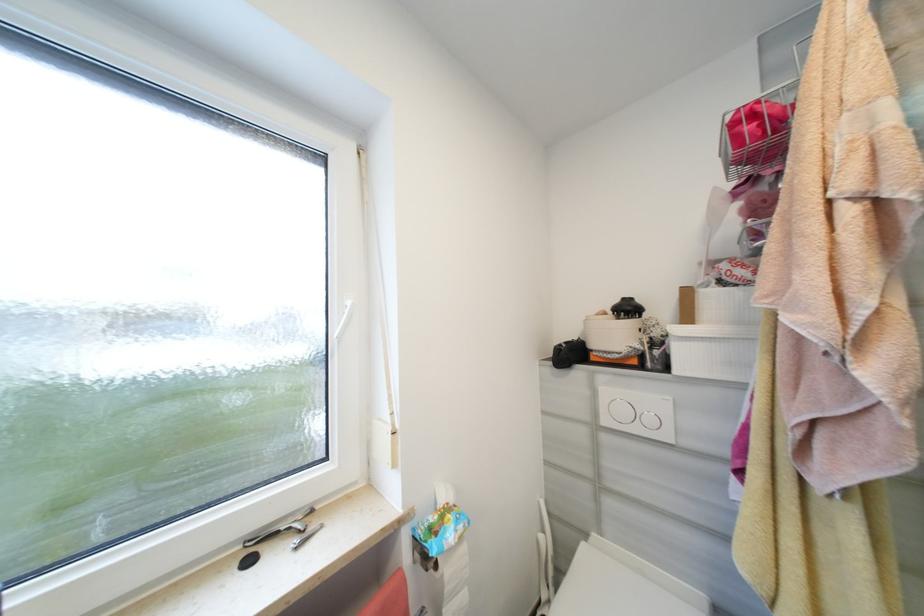
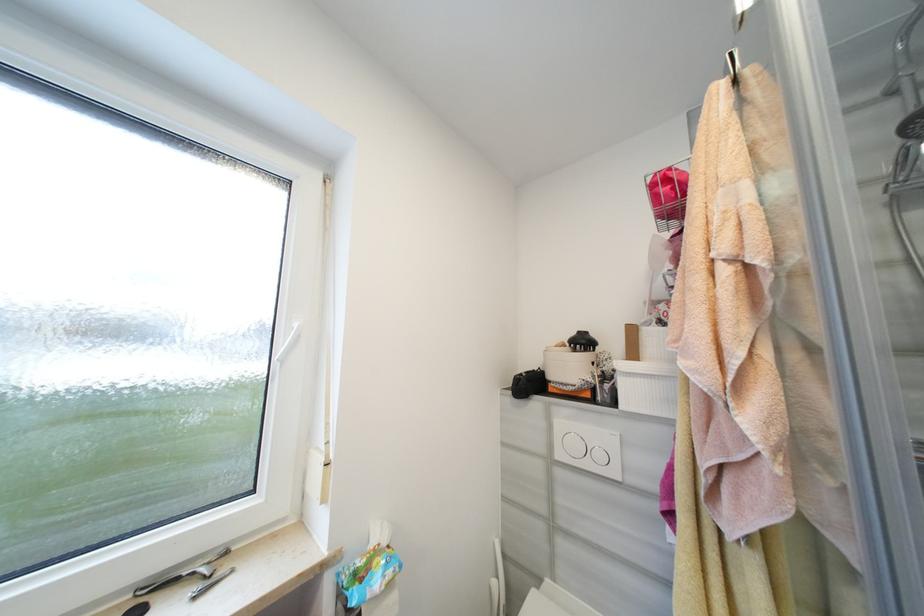
Question: Which direction would the cameraman need to move to produce the second image? Reply with the corresponding letter.

Choices:
 (A) Left
 (B) Right
 (C) Forward
 (D) Backward

Answer: (B)